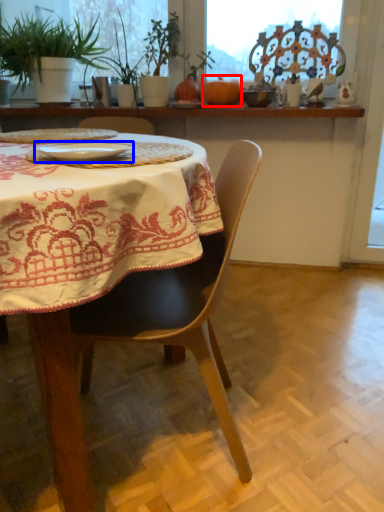
Question: Among these objects, which one is nearest to the camera, pumpkin (highlighted by a red box) or tableware (highlighted by a blue box)?

Choices:
 (A) pumpkin
 (B) tableware

Answer: (B)